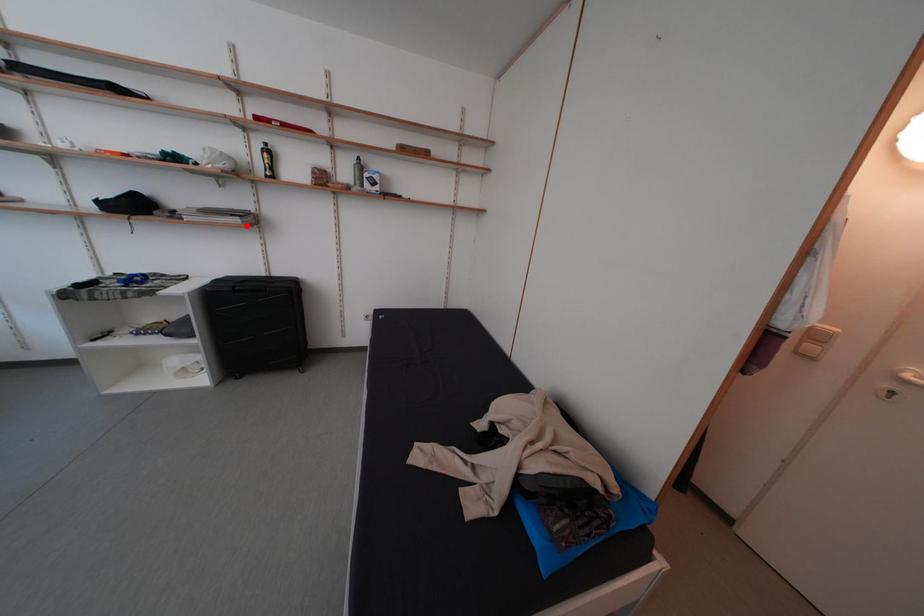
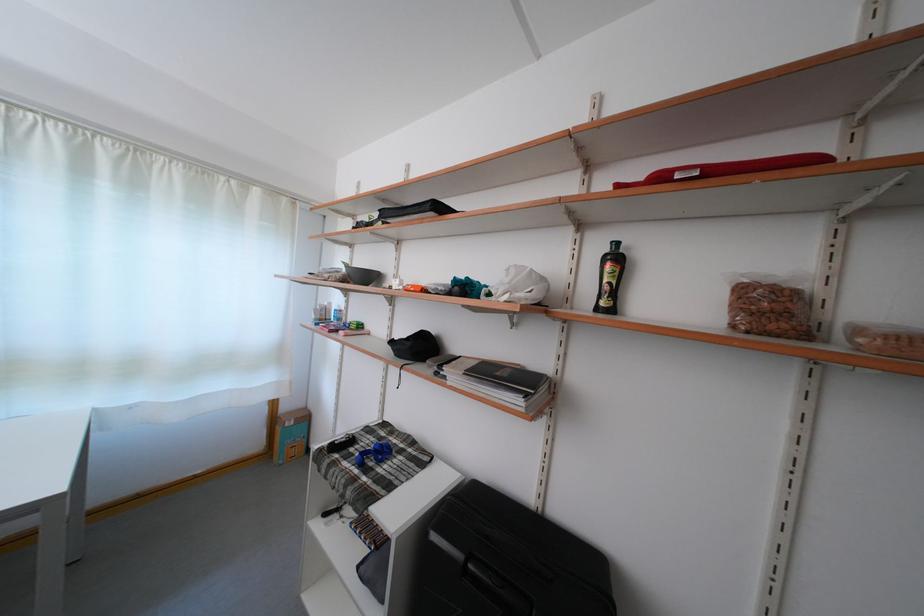
Find the pixel in the second image that matches the highlighted location in the first image.

(527, 408)